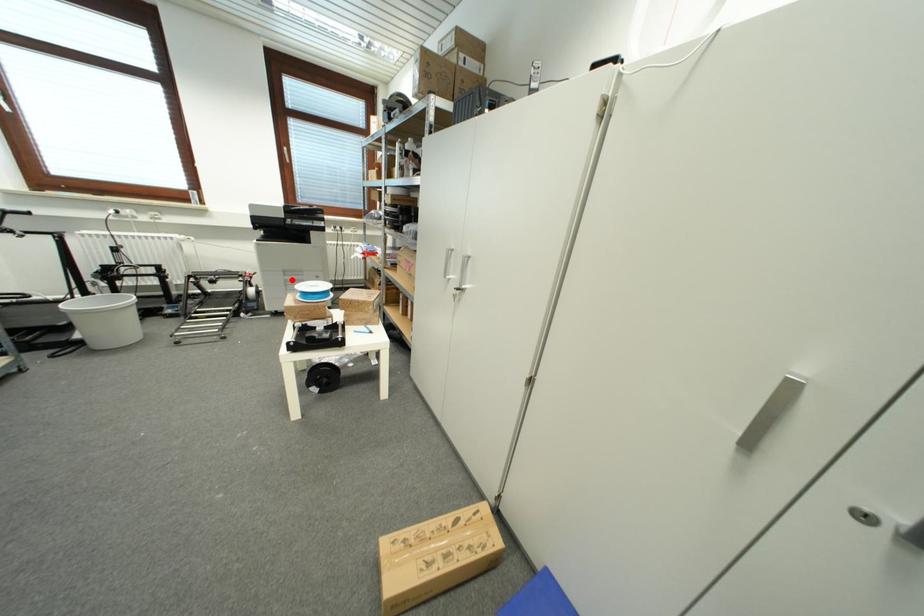
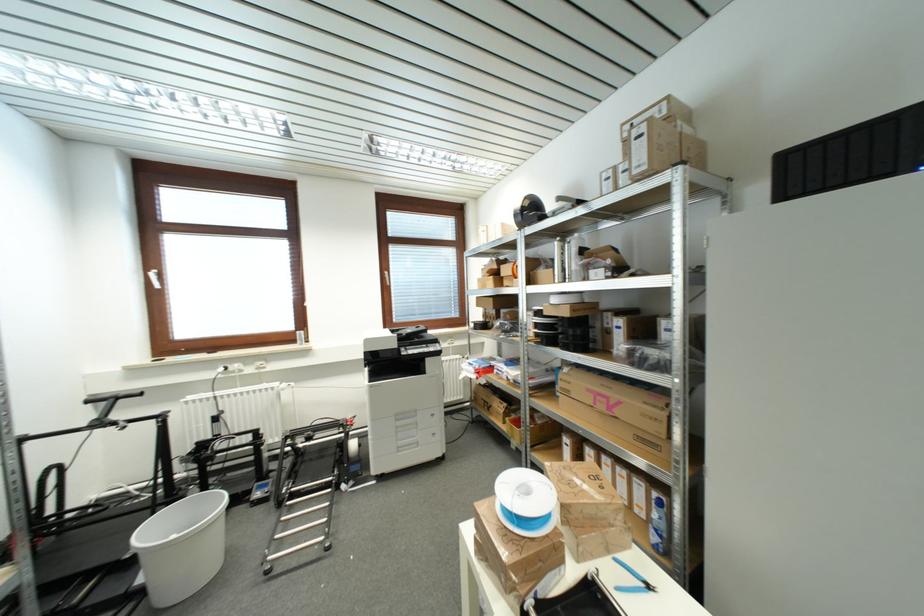
Where in the second image is the point corresponding to the highlighted location from the first image?

(404, 426)